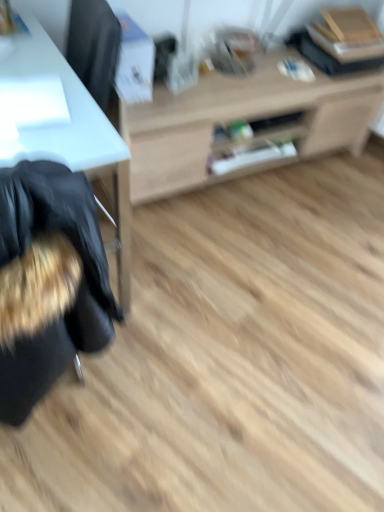
You are a GUI agent. You are given a task and a screenshot of the screen. Output one action in this format:
    pyautogui.click(x=<x>, y=<y>)
    Task: Click on the free space in front of light wood cabinet at center
    This screenshot has height=512, width=384.
    Given the screenshot: What is the action you would take?
    pyautogui.click(x=246, y=281)